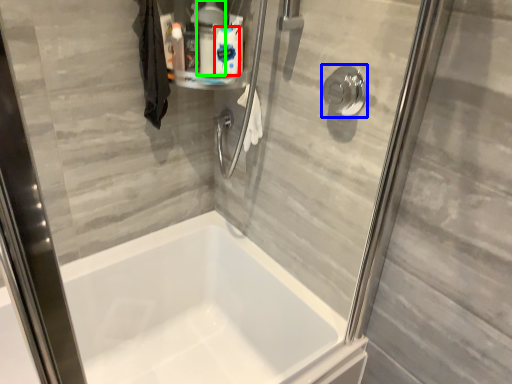
Question: Which is nearer to the cleaning product (highlighted by a red box)? shower (highlighted by a blue box) or cleaning product (highlighted by a green box).

Choices:
 (A) shower
 (B) cleaning product

Answer: (B)